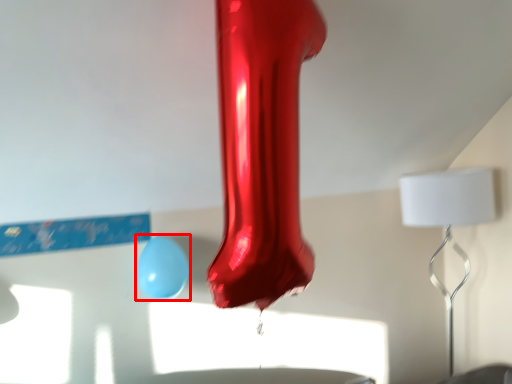
Question: Observing the image, what is the correct spatial positioning of balloon (annotated by the red box) in reference to lamp?

Choices:
 (A) left
 (B) right

Answer: (A)